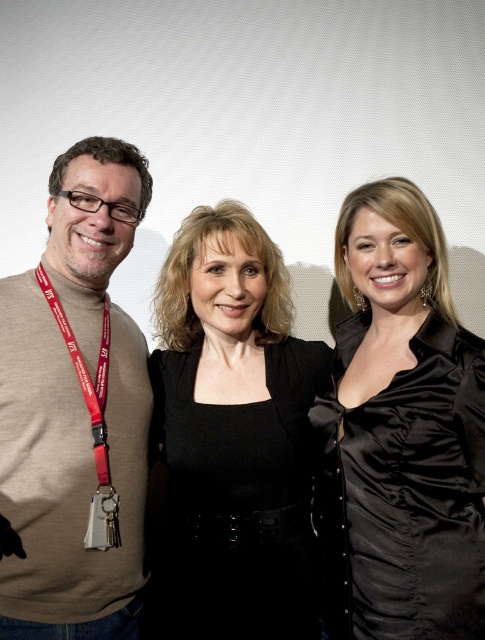
Question: Which object is closer to the camera taking this photo?

Choices:
 (A) white matte backdrop at center
 (B) silver metallic keychain at center
 (C) satin black blouse at center
 (D) black satin blouse at center

Answer: (C)

Question: Is satin black blouse at center bigger than beige turtleneck sweater at left?

Choices:
 (A) yes
 (B) no

Answer: (A)

Question: Considering the real-world distances, which object is farthest from the beige turtleneck sweater at left?

Choices:
 (A) silver metallic keychain at center
 (B) red fabric lanyard at left
 (C) white matte backdrop at center

Answer: (C)

Question: Does beige turtleneck sweater at left have a greater width compared to silver metallic keychain at center?

Choices:
 (A) yes
 (B) no

Answer: (A)

Question: From the image, what is the correct spatial relationship of white matte backdrop at center in relation to red fabric lanyard at left?

Choices:
 (A) right
 (B) left

Answer: (A)

Question: Which is nearer to the beige turtleneck sweater at left?

Choices:
 (A) satin black blouse at center
 (B) white matte backdrop at center

Answer: (A)